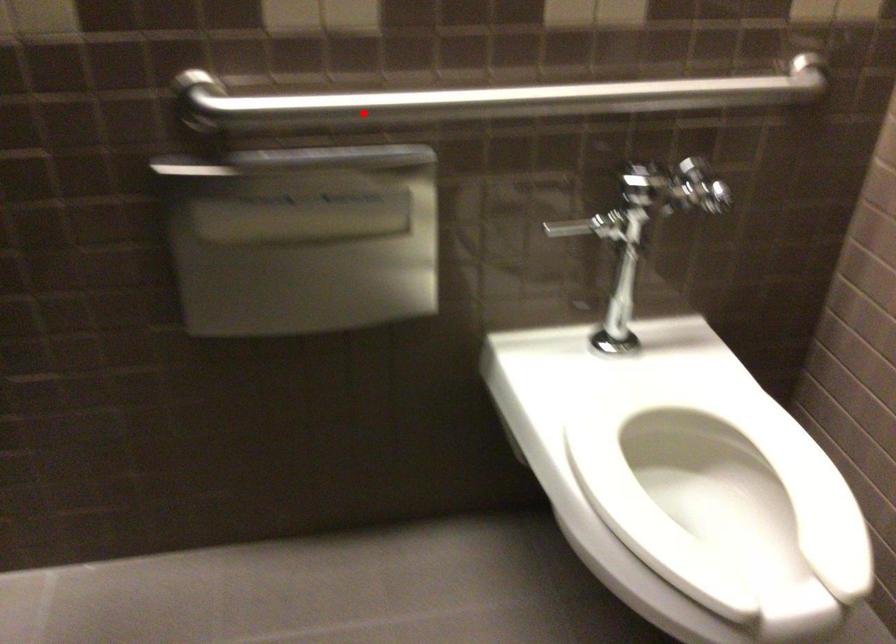
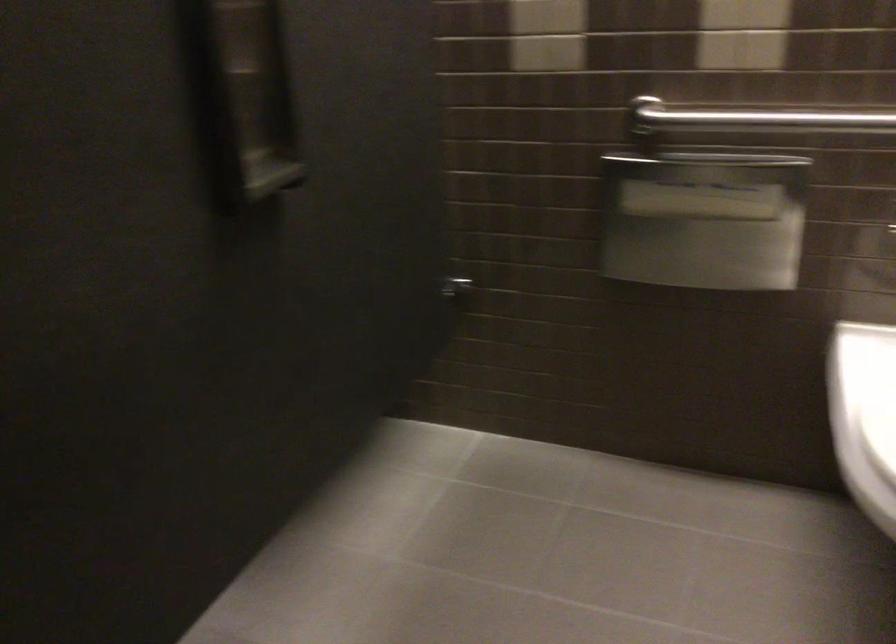
Question: I am providing you with two images of the same scene from different viewpoints. A red point is shown in image1. For the corresponding object point in image2, is it positioned nearer or farther from the camera?

Choices:
 (A) Nearer
 (B) Farther

Answer: (B)